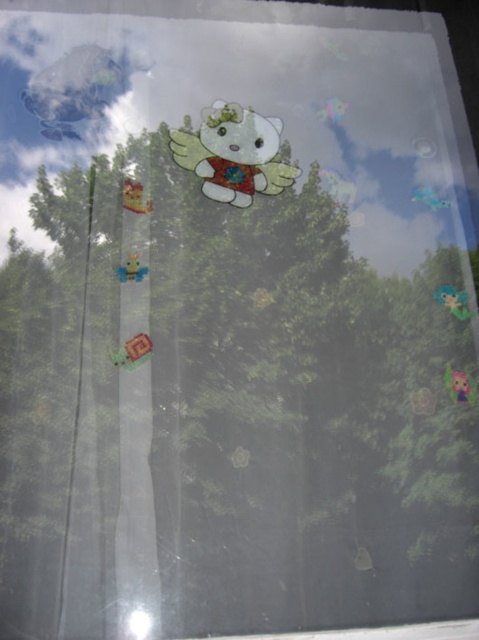
Measure the distance between shiny pink toy at bottom right and camera.

shiny pink toy at bottom right and camera are 4.64 feet apart.

Is shiny pink toy at bottom right below matte yellow plush at center?

Yes, shiny pink toy at bottom right is below matte yellow plush at center.

Between point (466, 394) and point (138, 273), which one is positioned behind?

The point (138, 273) is more distant.

At what (x,y) coordinates should I click in order to perform the action: click on shiny pink toy at bottom right. Please return your answer as a coordinate pair (x, y). Looking at the image, I should click on (458, 385).

Between shiny metallic robot at upper left and matte yellow plush at center, which one is positioned higher?

shiny metallic robot at upper left is higher up.

Is shiny metallic robot at upper left in front of matte yellow plush at center?

No, shiny metallic robot at upper left is behind matte yellow plush at center.

Which is in front, point (91, 81) or point (121, 273)?

Point (121, 273)

This screenshot has width=479, height=640. I want to click on shiny metallic robot at upper left, so click(x=76, y=88).

Is point (228, 182) positioned after point (465, 308)?

Yes.

Does matte plastic hello kitty at center appear over blue fabric flower at lower right?

Indeed, matte plastic hello kitty at center is positioned over blue fabric flower at lower right.

At what (x,y) coordinates should I click in order to perform the action: click on matte plastic hello kitty at center. Please return your answer as a coordinate pair (x, y). The height and width of the screenshot is (640, 479). Looking at the image, I should click on (234, 154).